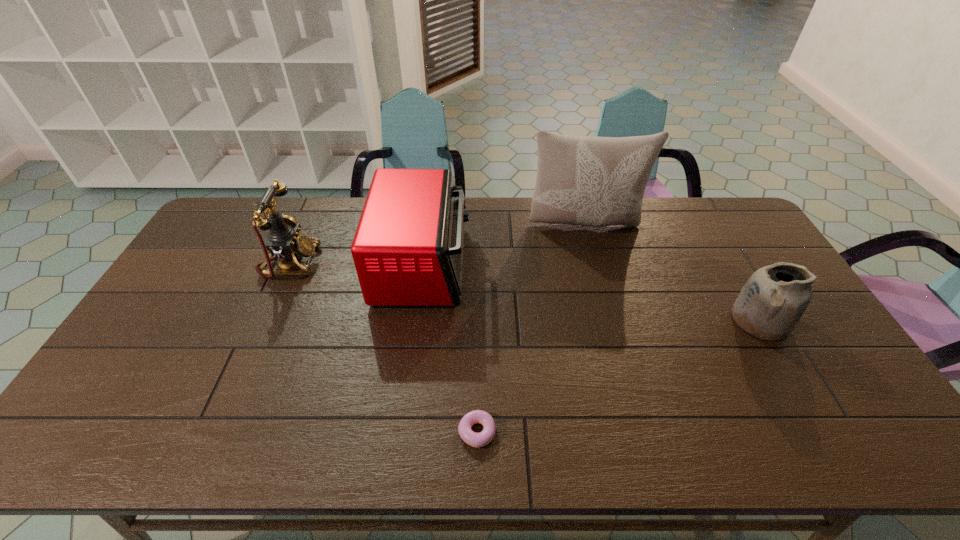
The image size is (960, 540). What are the coordinates of `free region at the right edge` in the screenshot? It's located at (819, 374).

I want to click on vacant region at the far left corner of the desktop, so click(x=230, y=220).

Where is `vacant area at the near right corner`? vacant area at the near right corner is located at coordinates (844, 422).

The image size is (960, 540). What are the coordinates of `blank region between the nearest object and the second object from right to left` in the screenshot? It's located at (531, 328).

This screenshot has width=960, height=540. Identify the location of empty space that is in between the nearest object and the rightmost object. point(618,376).

Locate an element on the screen. Image resolution: width=960 pixels, height=540 pixels. free space between the rightmost object and the leftmost object is located at coordinates (525, 291).

Locate an element on the screen. This screenshot has width=960, height=540. unoccupied area between the doughnut and the leftmost object is located at coordinates (384, 348).

Identify the location of vacant point located between the doughnut and the toaster oven. The width and height of the screenshot is (960, 540). (450, 349).

This screenshot has height=540, width=960. What are the coordinates of `unoccupied position between the shortest object and the tallest object` in the screenshot? It's located at (531, 328).

Identify the location of free space between the tallest object and the toaster oven. The height and width of the screenshot is (540, 960). (504, 245).